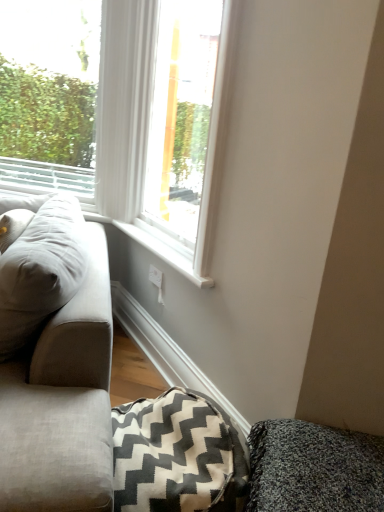
Question: In terms of size, does light gray fabric couch at left appear bigger or smaller than white painted wood at lower center?

Choices:
 (A) big
 (B) small

Answer: (A)

Question: Considering their positions, is light gray fabric couch at left located in front of or behind white painted wood at lower center?

Choices:
 (A) behind
 (B) front

Answer: (B)

Question: Based on their relative distances, which object is nearer to the white plastic window at upper left, the 1th window viewed from the left?

Choices:
 (A) white glossy window at center, the second window when ordered from left to right
 (B) white painted wood at lower center
 (C) gray zigzag-patterned blanket at lower center
 (D) light gray fabric couch at left
 (E) textured gray cushion at lower right

Answer: (A)

Question: Considering the real-world distances, which object is farthest from the gray zigzag-patterned blanket at lower center?

Choices:
 (A) textured gray cushion at lower right
 (B) white painted wood at lower center
 (C) white glossy window at center, the second window when ordered from left to right
 (D) light gray fabric couch at left
 (E) white plastic window at upper left, acting as the second window starting from the right

Answer: (E)